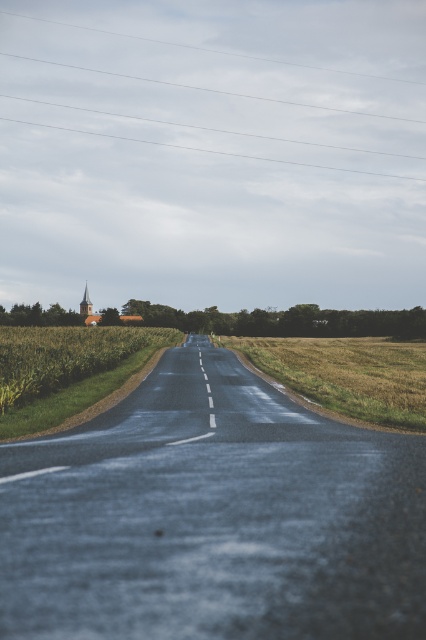
You are driving a car and see the golden grassy field at center and the green grassy corn field at left. Which field is closer to you?

The golden grassy field at center is closer to you because it is in front of the green grassy corn field at left.

You are standing at the starting point of the rural road scene. You want to reach the golden grassy field at center. Which direction should you walk to reach it?

The golden grassy field at center is located at point (348, 374), so you should walk forward along the road towards the center of the scene to reach it.

You are a delivery driver approaching the golden grassy field at center and the green grassy corn field at left. Your truck requires a 20 meter turning radius to safely make a U turn. Can you determine if there is enough space between the fields to perform the U turn?

The distance between the golden grassy field at center and the green grassy corn field at left is 20.39 meters, which is just enough to accommodate the truck requiring a 20 meter turning radius. Therefore, there is sufficient space to safely perform the U turn.